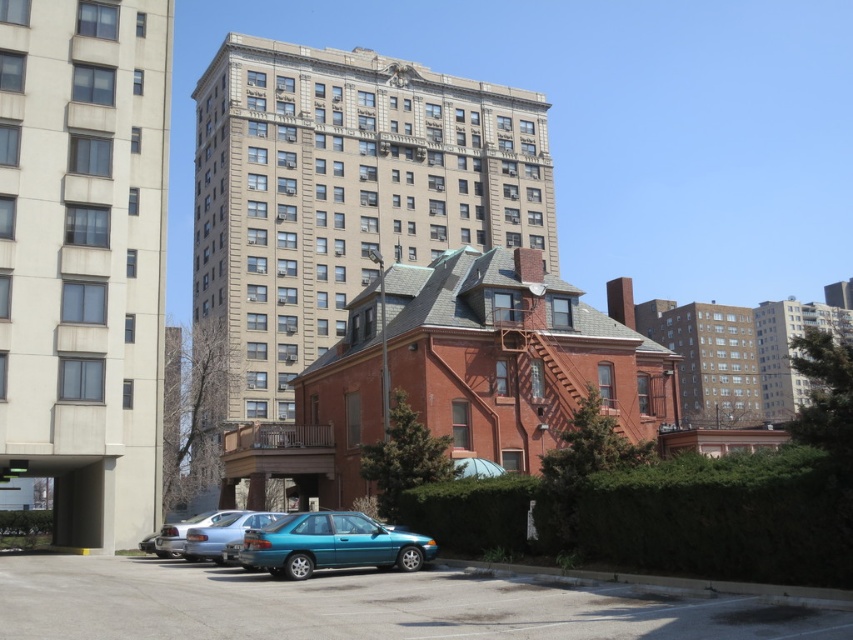
Question: Which object is positioned farthest from the beige stone building at center?

Choices:
 (A) teal glossy sedan at lower center
 (B) beige stone building at upper right
 (C) matte silver sedan at lower left
 (D) gray concrete building at center

Answer: (A)

Question: Does beige stone building at center come behind matte silver sedan at lower left?

Choices:
 (A) yes
 (B) no

Answer: (A)

Question: Which of the following is the farthest from the observer?

Choices:
 (A) beige concrete building at center
 (B) satin silver sedan at lower left
 (C) matte silver sedan at lower left
 (D) teal glossy sedan at lower center

Answer: (A)

Question: Which point is closer to the camera?

Choices:
 (A) (788, 396)
 (B) (380, 552)

Answer: (B)

Question: Does beige concrete building at center appear over gray concrete building at center?

Choices:
 (A) yes
 (B) no

Answer: (A)

Question: Is beige concrete building at center positioned behind gray concrete building at center?

Choices:
 (A) yes
 (B) no

Answer: (B)